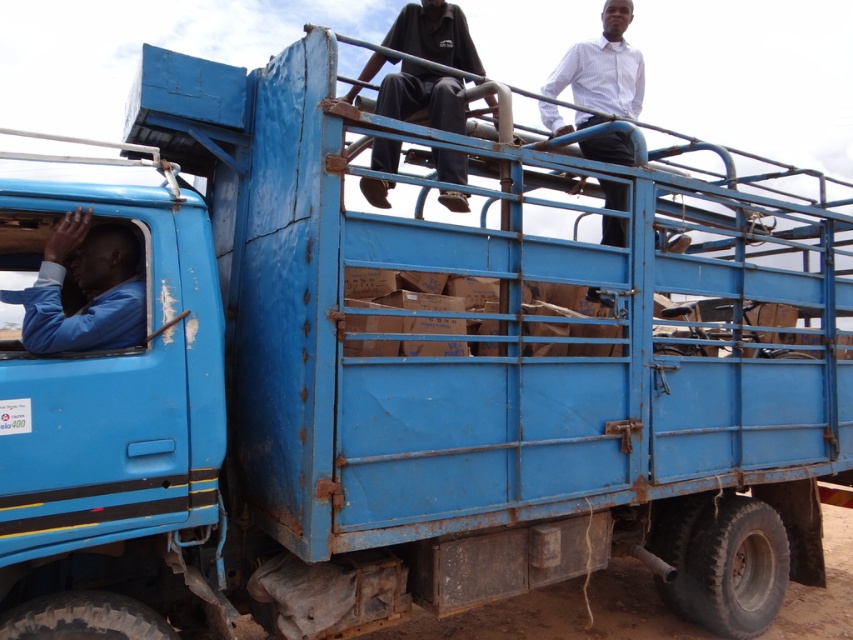
Between point (128, 312) and point (477, 58), which one is positioned behind?

The point (477, 58) is behind.

Find the location of a particular element. blue matte shirt at left is located at coordinates (84, 289).

What do you see at coordinates (84, 289) in the screenshot? The width and height of the screenshot is (853, 640). I see `blue matte shirt at left` at bounding box center [84, 289].

You are a GUI agent. You are given a task and a screenshot of the screen. Output one action in this format:
    pyautogui.click(x=<x>, y=<y>)
    Task: Click on the blue matte shirt at left
    The image size is (853, 640).
    Given the screenshot: What is the action you would take?
    pyautogui.click(x=84, y=289)